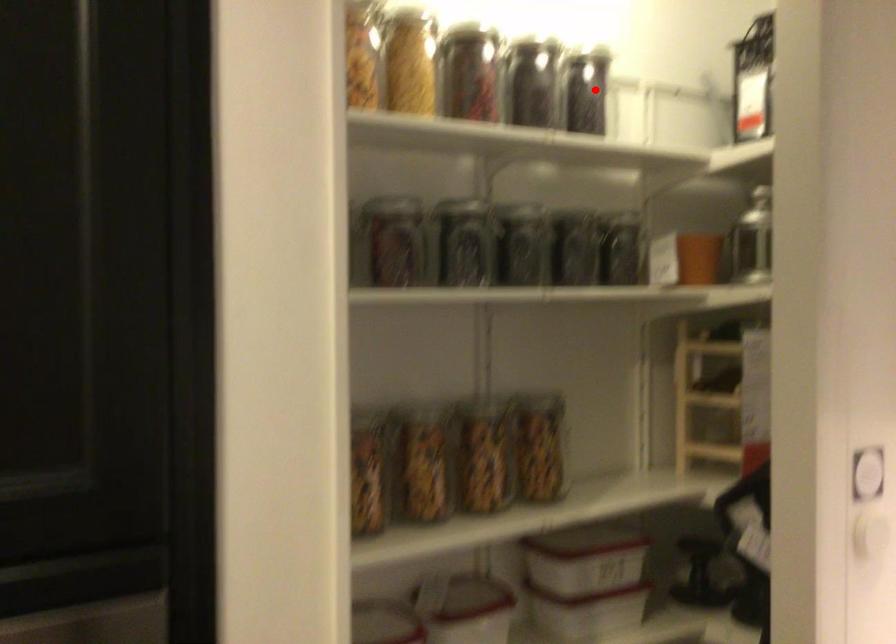
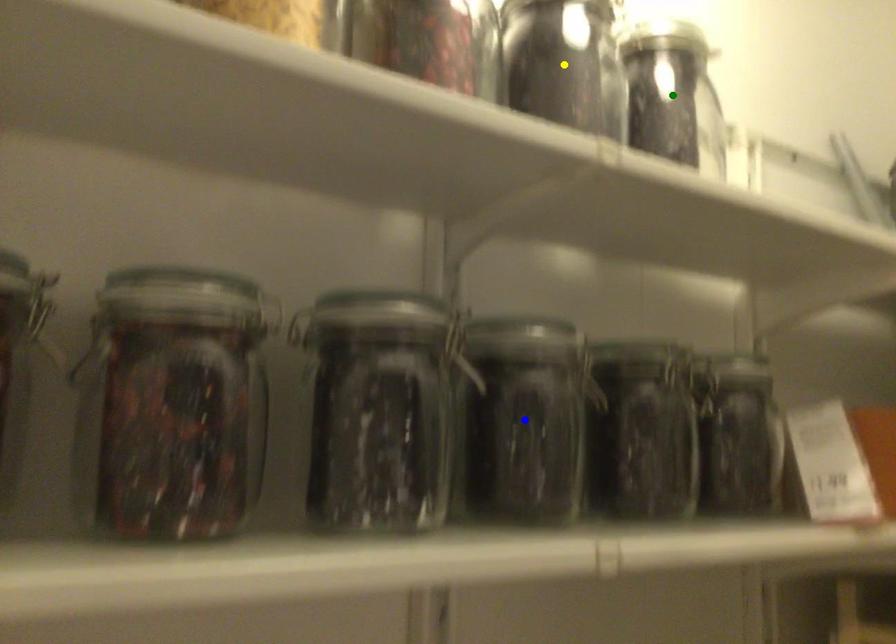
Question: I am providing you with two images of the same scene from different viewpoints. A red point is marked on the first image. You are given multiple points on the second image. Which point in image 2 represents the same 3d spot as the red point in image 1?

Choices:
 (A) green point
 (B) yellow point
 (C) blue point

Answer: (A)